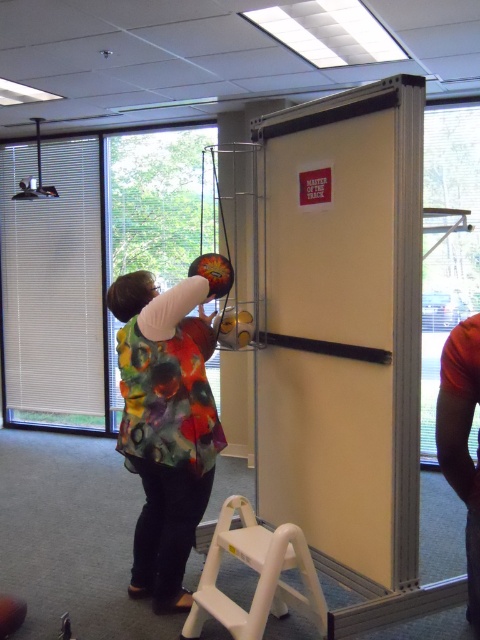
You are a delivery person trying to enter the room through the door. The white matte screen door at center and the matte white glass door at left are both unlocked. Which door should you choose if you want to enter through the wider one?

The matte white glass door at left is wider than the white matte screen door at center, so you should choose the matte white glass door at left to enter through the wider one.

You are standing in the room and want to pick up the object at point (380, 228). If your arm can reach 2 meters, can you reach it?

The point (380, 228) is 2.31 meters away from you, so you cannot reach it with an arm length of 2 meters.

You are standing in the room and want to exit through the white matte screen door at center. To do so, you must first pass by the multicolored fabric vest at center. Which object should you approach first?

The multicolored fabric vest at center is on the left side of the white matte screen door at center, so you should approach the multicolored fabric vest at center first before reaching the white matte screen door at center.